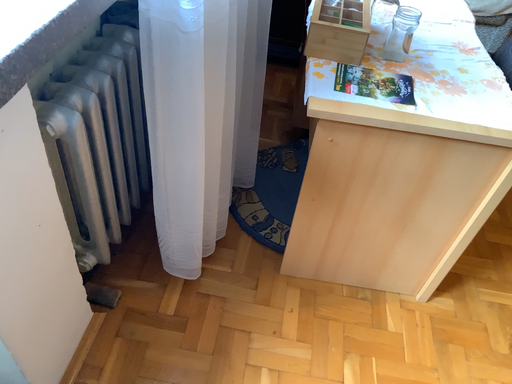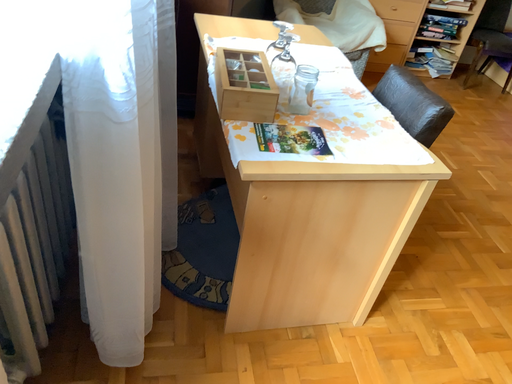
Question: Which way did the camera rotate in the video?

Choices:
 (A) rotated left
 (B) rotated right

Answer: (B)